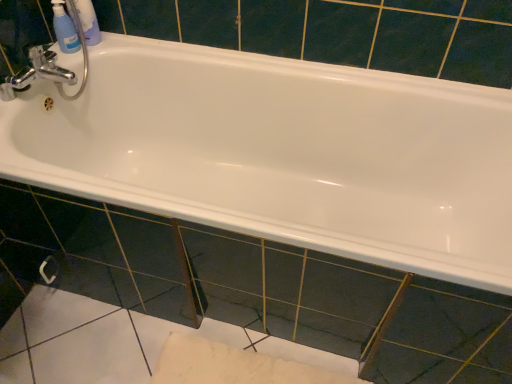
Question: Could you tell me if silver metallic towel bar at lower left is facing transparent plastic mouthwash at upper left?

Choices:
 (A) no
 (B) yes

Answer: (A)

Question: Considering the relative positions of silver metallic towel bar at lower left and transparent plastic mouthwash at upper left in the image provided, is silver metallic towel bar at lower left behind transparent plastic mouthwash at upper left?

Choices:
 (A) yes
 (B) no

Answer: (A)

Question: From the image's perspective, is silver metallic towel bar at lower left located beneath transparent plastic mouthwash at upper left?

Choices:
 (A) no
 (B) yes

Answer: (B)

Question: Is silver metallic towel bar at lower left touching transparent plastic mouthwash at upper left?

Choices:
 (A) no
 (B) yes

Answer: (A)

Question: Would you consider silver metallic towel bar at lower left to be distant from transparent plastic mouthwash at upper left?

Choices:
 (A) no
 (B) yes

Answer: (A)

Question: Does silver metallic towel bar at lower left have a greater height compared to transparent plastic mouthwash at upper left?

Choices:
 (A) yes
 (B) no

Answer: (B)

Question: Considering the relative sizes of white glossy bathtub at center and translucent plastic bottles at upper left in the image provided, is white glossy bathtub at center bigger than translucent plastic bottles at upper left?

Choices:
 (A) yes
 (B) no

Answer: (A)

Question: Is white glossy bathtub at center outside of translucent plastic bottles at upper left?

Choices:
 (A) no
 (B) yes

Answer: (B)

Question: Does white glossy bathtub at center come behind translucent plastic bottles at upper left?

Choices:
 (A) no
 (B) yes

Answer: (A)

Question: Can you confirm if white glossy bathtub at center is positioned to the right of translucent plastic bottles at upper left?

Choices:
 (A) yes
 (B) no

Answer: (A)

Question: From the image's perspective, is white glossy bathtub at center above translucent plastic bottles at upper left?

Choices:
 (A) yes
 (B) no

Answer: (B)

Question: From the image's perspective, would you say white glossy bathtub at center is shown under translucent plastic bottles at upper left?

Choices:
 (A) no
 (B) yes

Answer: (B)

Question: From the image's perspective, is translucent plastic bottles at upper left over white glossy bathtub at center?

Choices:
 (A) no
 (B) yes

Answer: (B)